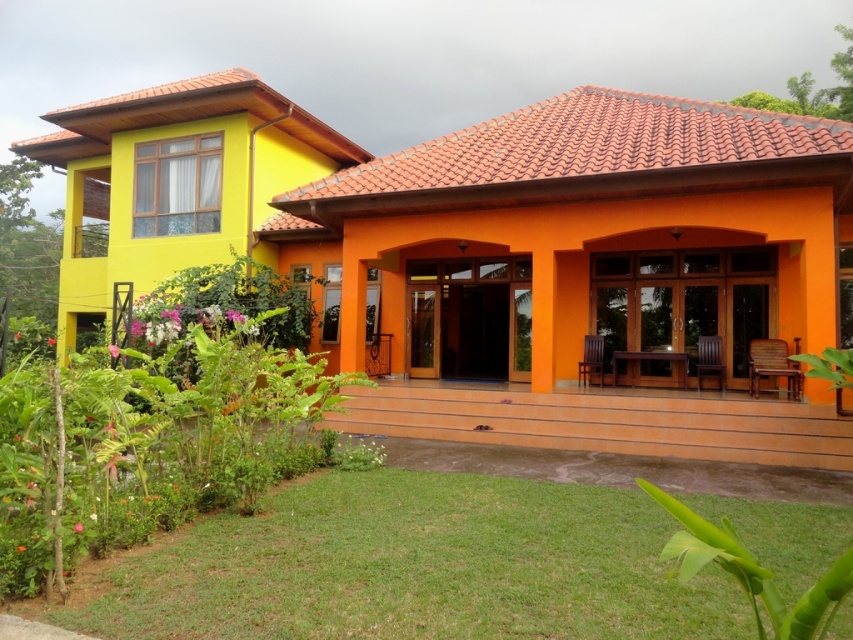
You are standing at the center of the image. Which direction should you move to reach the green grass at lower left?

The green grass at lower left is located at point 0.886 on the x axis and 0.482 on the y axis. Since you are at the center, you should move towards the lower left direction to reach it.

You are standing on the porch of the house and looking towards the lower left corner. Which of the two items, the green grass at lower left or the green leafy plants at lower left, covers a smaller area?

The green grass at lower left occupies less space than the green leafy plants at lower left, so the green grass at lower left covers a smaller area.

You are standing at the front of the house and want to walk to the point marked at coordinates point (277, 497) and point (108, 538). Which point is closer to you?

Point (108, 538) is closer to you because it is in front of point (277, 497).